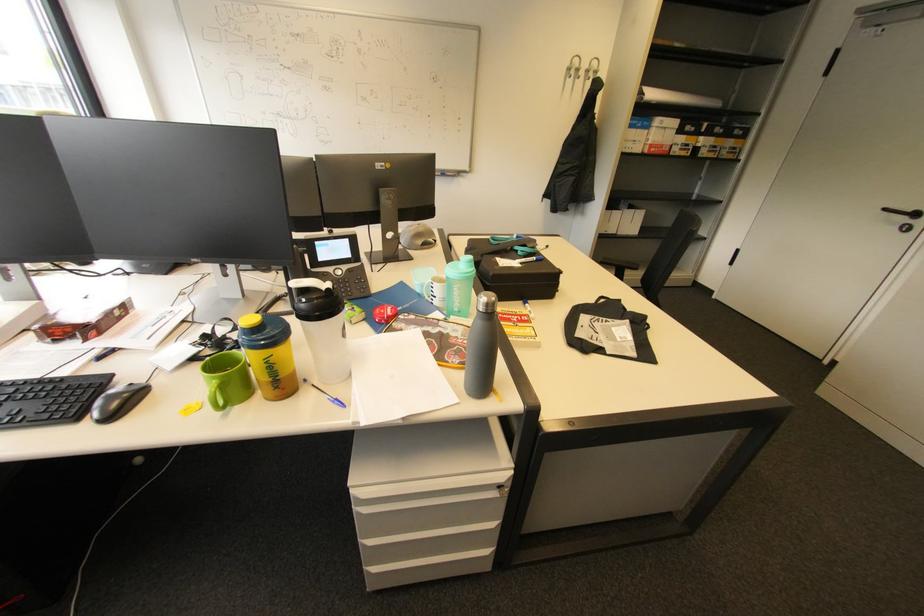
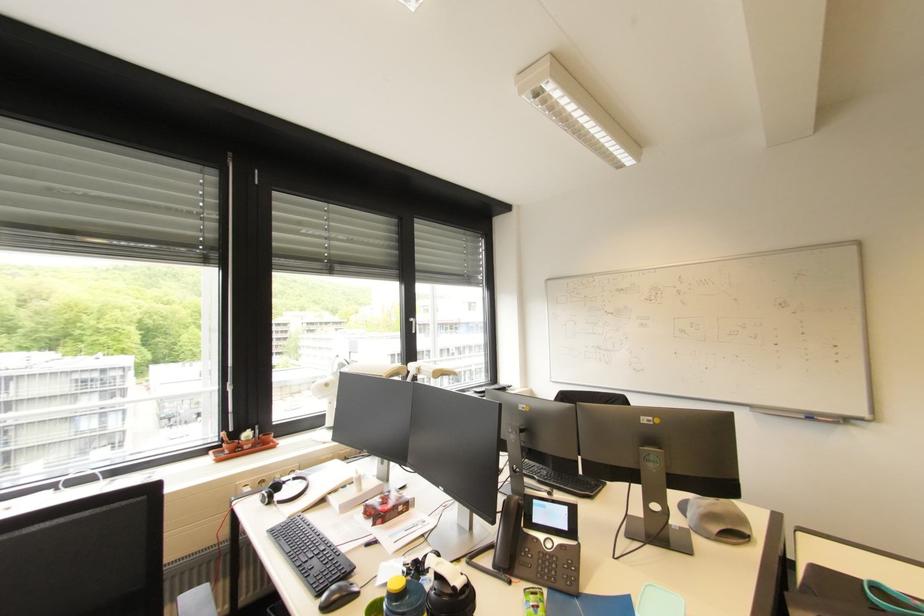
Find the pixel in the second image that matches the point at 305,299 in the first image.

(441, 583)